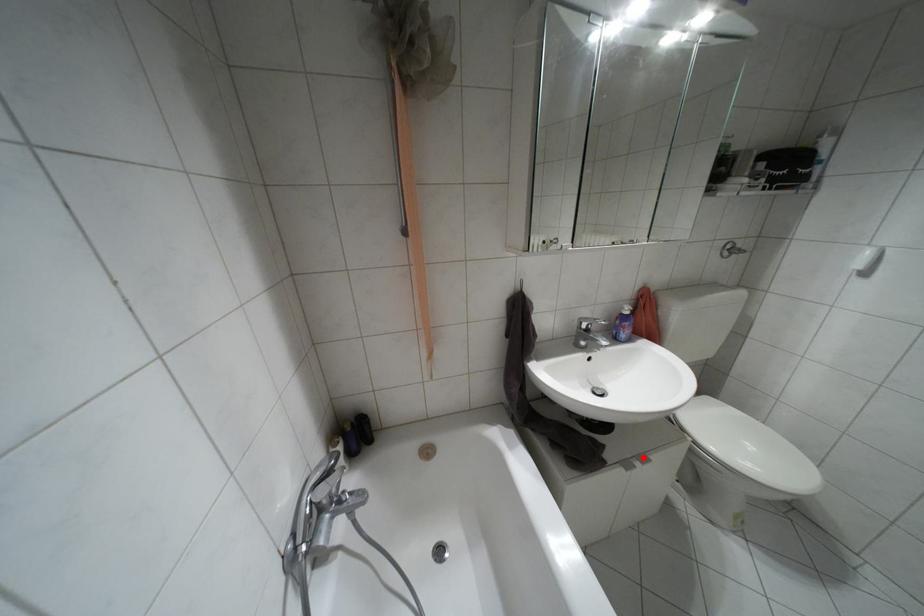
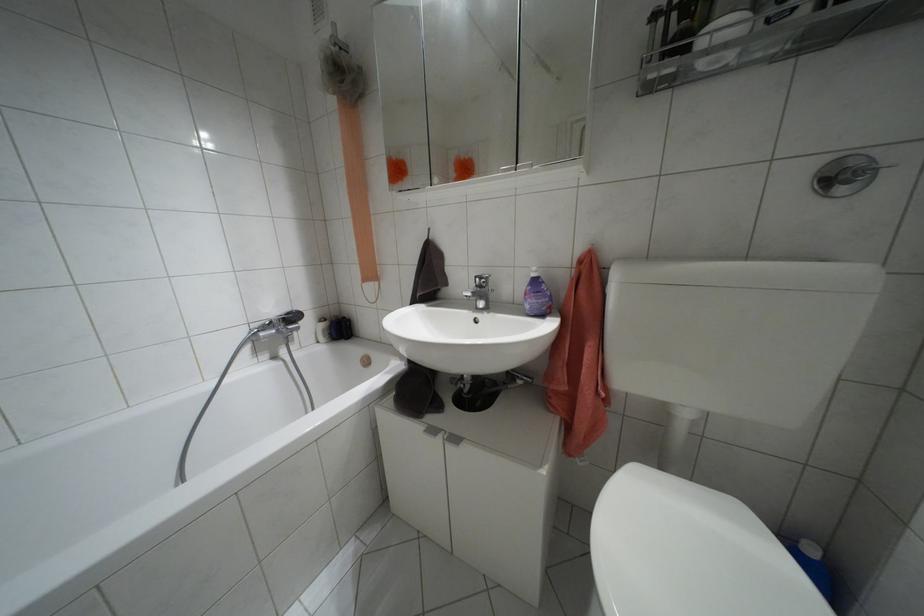
Find the pixel in the second image that matches the highlighted location in the first image.

(455, 439)